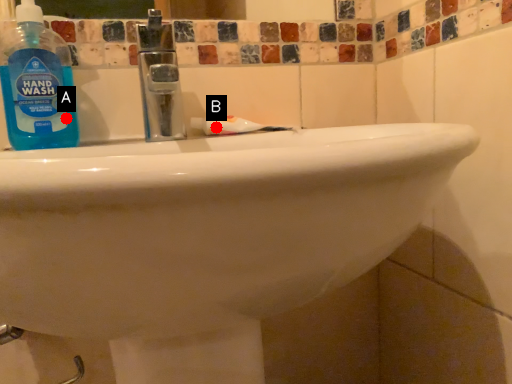
Question: Two points are circled on the image, labeled by A and B beside each circle. Which point appears closest to the camera in this image?

Choices:
 (A) A is closer
 (B) B is closer

Answer: (A)